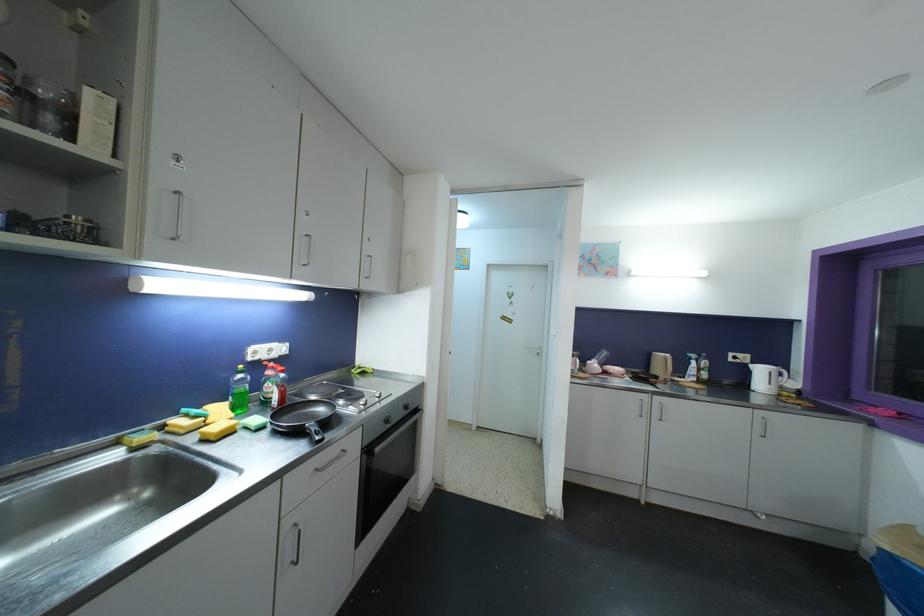
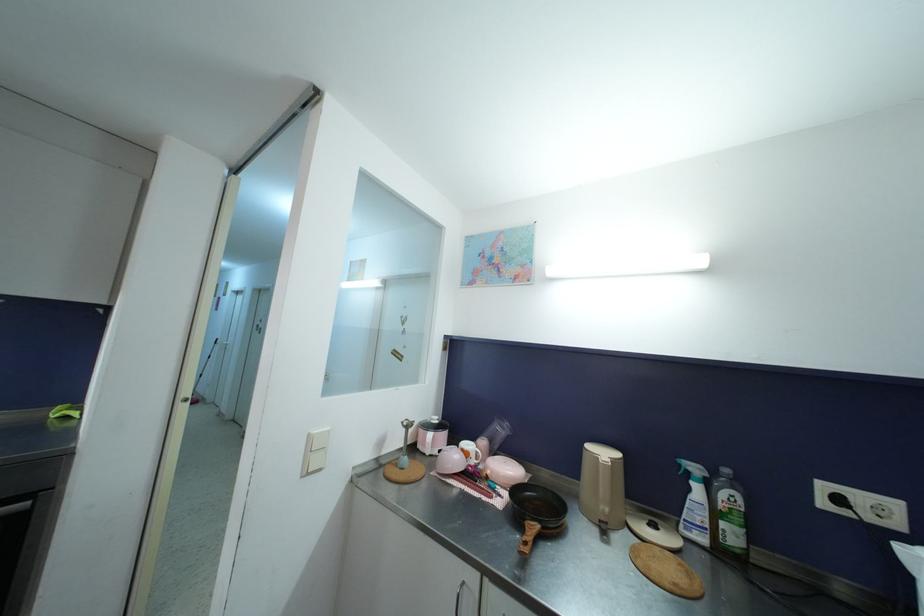
Locate, in the second image, the point that corresponds to (x=734, y=362) in the first image.

(827, 507)